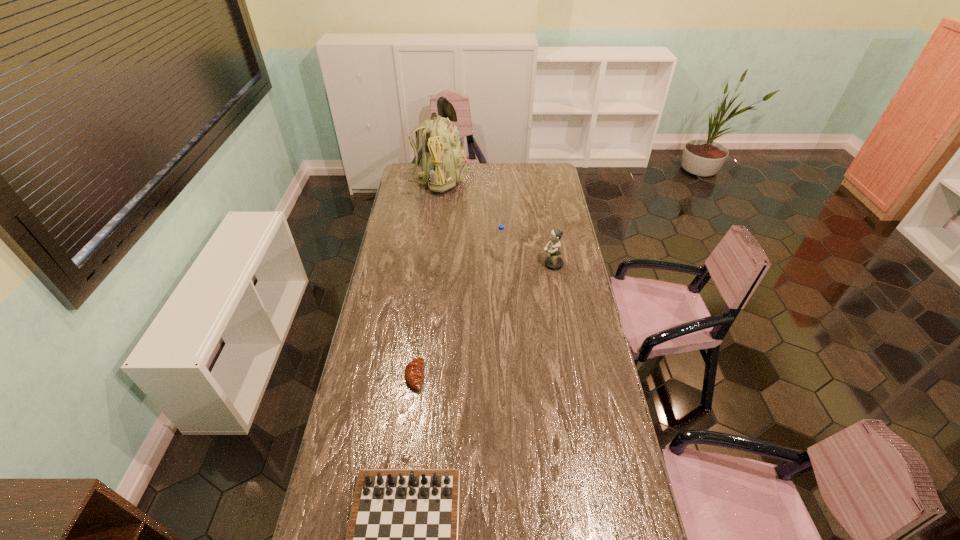
At what (x,y) coordinates should I click in order to perform the action: click on the farthest object. Please return your answer as a coordinate pair (x, y). This screenshot has height=540, width=960. Looking at the image, I should click on (443, 164).

The height and width of the screenshot is (540, 960). Identify the location of backpack. (443, 164).

At what (x,y) coordinates should I click in order to perform the action: click on figurine. Please return your answer as a coordinate pair (x, y). The height and width of the screenshot is (540, 960). Looking at the image, I should click on (553, 262).

At what (x,y) coordinates should I click in order to perform the action: click on water bottle. Please return your answer as a coordinate pair (x, y). The width and height of the screenshot is (960, 540). Looking at the image, I should click on (500, 242).

Find the location of a particular element. The image size is (960, 540). the shortest object is located at coordinates (413, 374).

Locate an element on the screen. The width and height of the screenshot is (960, 540). crescent roll is located at coordinates 413,374.

At what (x,y) coordinates should I click in order to perform the action: click on vacant space located on the front-facing side of the backpack. Please return your answer as a coordinate pair (x, y). This screenshot has height=540, width=960. Looking at the image, I should click on (494, 180).

Where is `free space located on the front-facing side of the rightmost object`? The image size is (960, 540). free space located on the front-facing side of the rightmost object is located at coordinates (518, 265).

I want to click on vacant region located on the front-facing side of the rightmost object, so click(512, 265).

Locate an element on the screen. The image size is (960, 540). blank space located 0.330m on the front-facing side of the rightmost object is located at coordinates (471, 265).